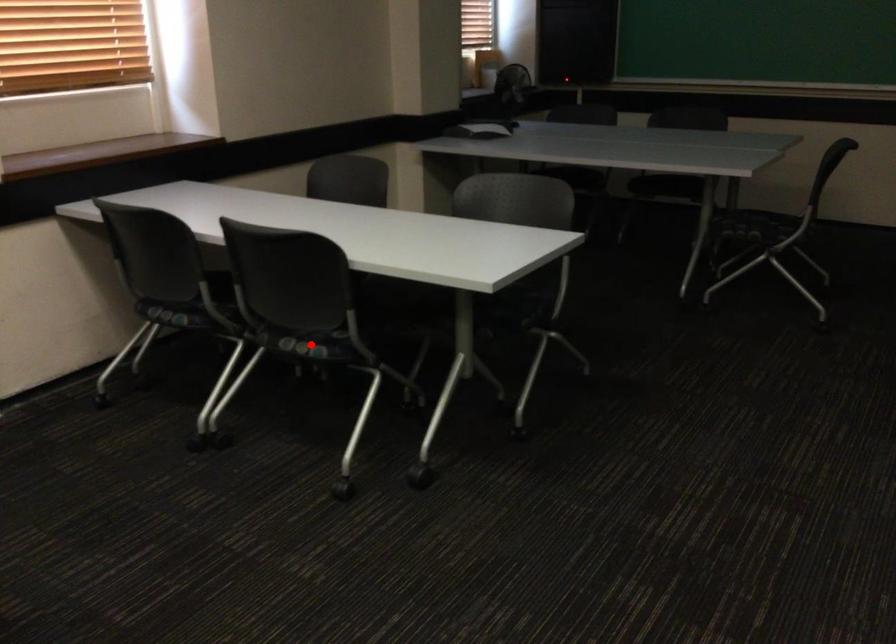
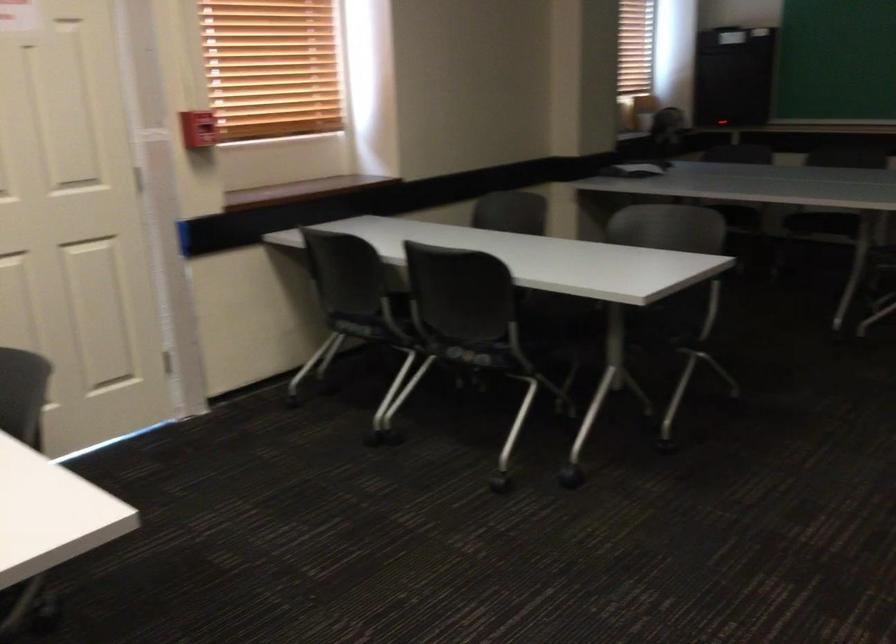
Find the pixel in the second image that matches the highlighted location in the first image.

(474, 354)